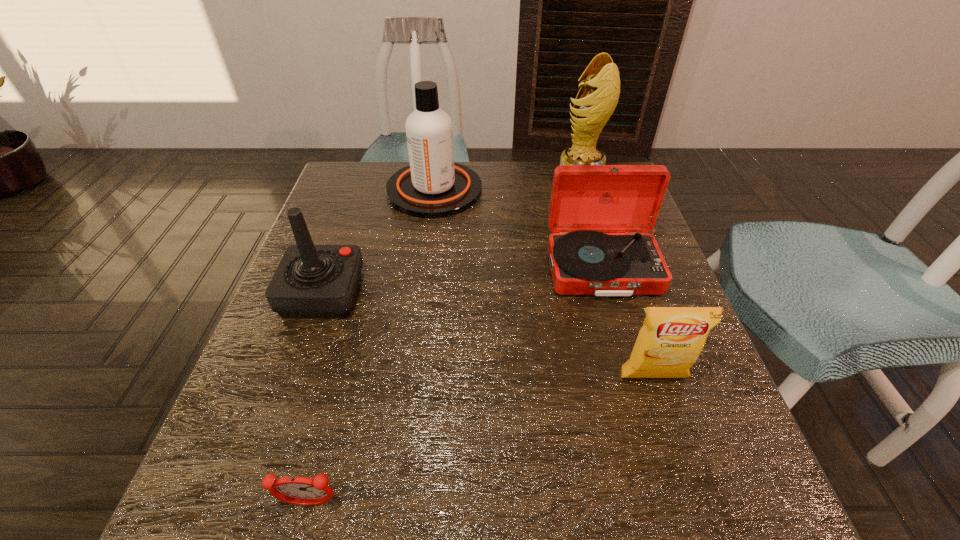
Identify the location of award present at the right edge. The height and width of the screenshot is (540, 960). (600, 92).

Find the location of `phonograph_record located at the right edge`. phonograph_record located at the right edge is located at coordinates (586, 200).

Locate an element on the screen. The width and height of the screenshot is (960, 540). crisp (potato chip) that is at the right edge is located at coordinates tap(671, 339).

Locate an element on the screen. This screenshot has height=540, width=960. object situated at the far left corner is located at coordinates (433, 186).

Identify the location of object present at the near left corner. This screenshot has width=960, height=540. (296, 490).

The height and width of the screenshot is (540, 960). I want to click on object situated at the far right corner, so click(x=600, y=92).

Where is `vacant region at the far edge`? This screenshot has height=540, width=960. vacant region at the far edge is located at coordinates (484, 198).

Locate an element on the screen. vacant point at the near edge is located at coordinates (590, 526).

In the image, there is a desktop. Where is `vacant space at the left edge`? This screenshot has width=960, height=540. vacant space at the left edge is located at coordinates (336, 318).

In the image, there is a desktop. Where is `vacant space at the right edge`? vacant space at the right edge is located at coordinates (694, 384).